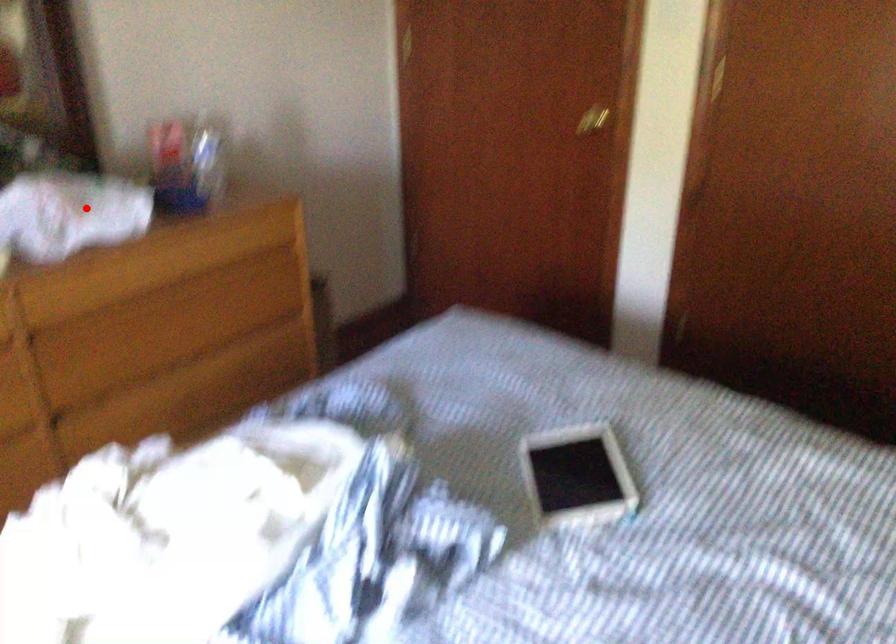
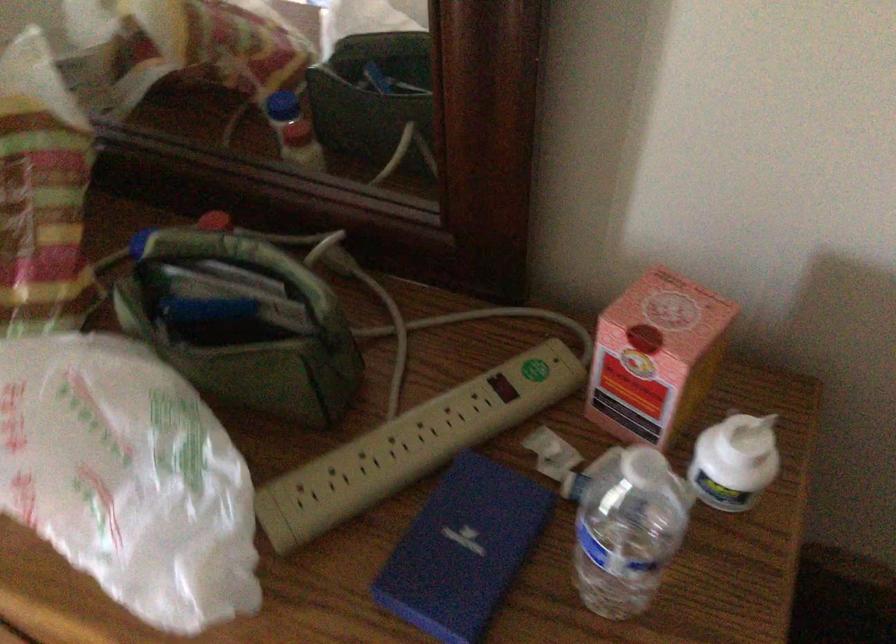
Locate, in the second image, the point that corresponds to the highlighted location in the first image.

(126, 478)